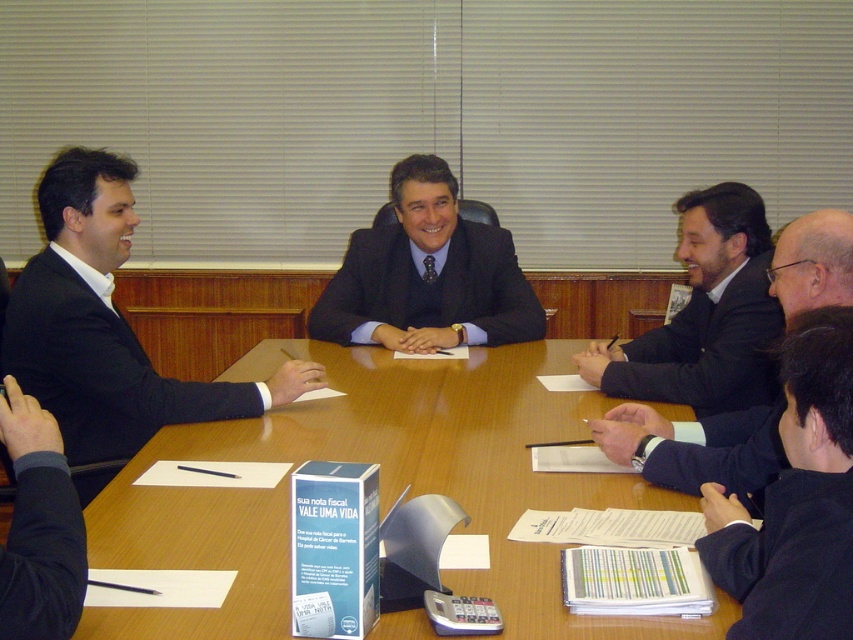
Consider the image. In the meeting scene, there are two individuals wearing the black suit at right and the dark blue fabric business suit at lower right. Which one is positioned to the right of the other?

The black suit at right is positioned to the right of the dark blue fabric business suit at lower right.